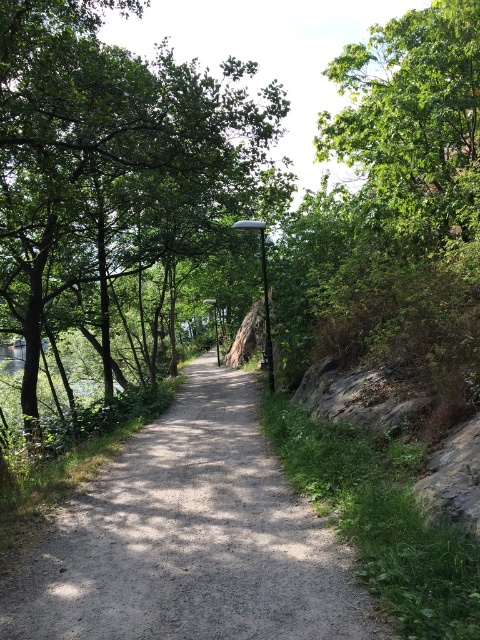
Can you confirm if dirt/gravel path at center is thinner than green leafy tree at upper right?

Yes, dirt/gravel path at center is thinner than green leafy tree at upper right.

Does dirt/gravel path at center have a lesser height compared to green leafy tree at upper right?

Indeed, dirt/gravel path at center has a lesser height compared to green leafy tree at upper right.

Between point (233, 371) and point (343, 141), which one is positioned behind?

Point (233, 371)

The width and height of the screenshot is (480, 640). In order to click on dirt/gravel path at center in this screenshot , I will do (x=190, y=540).

Does point (39, 272) come in front of point (212, 632)?

No, (39, 272) is further to viewer.

Between green leafy tree at upper left and dirt/gravel path at center, which one appears on the right side from the viewer's perspective?

dirt/gravel path at center is more to the right.

Where is `green leafy tree at upper left`? This screenshot has height=640, width=480. green leafy tree at upper left is located at coordinates (112, 163).

The width and height of the screenshot is (480, 640). I want to click on green leafy tree at upper left, so click(x=112, y=163).

Does green leafy tree at upper left appear over green leafy tree at upper right?

Yes, green leafy tree at upper left is above green leafy tree at upper right.

Who is more forward, (247, 150) or (475, 10)?

Point (475, 10)

Locate an element on the screen. Image resolution: width=480 pixels, height=640 pixels. green leafy tree at upper left is located at coordinates click(x=112, y=163).